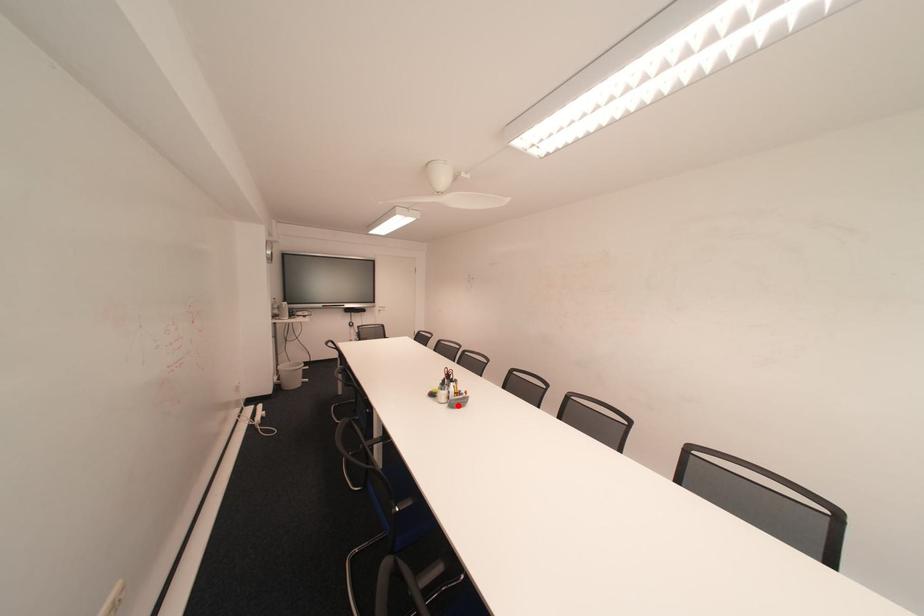
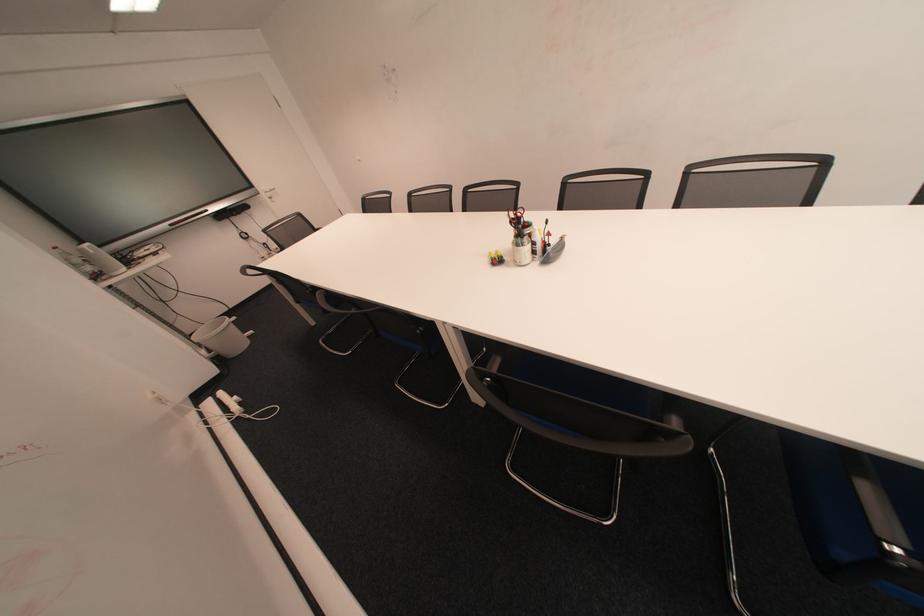
In the second image, find the point that corresponds to the highlighted location in the first image.

(550, 262)